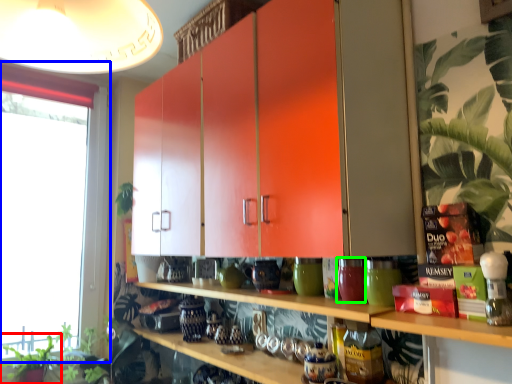
Question: Which is nearer to the plant (highlighted by a red box)? window (highlighted by a blue box) or pottery (highlighted by a green box).

Choices:
 (A) window
 (B) pottery

Answer: (A)